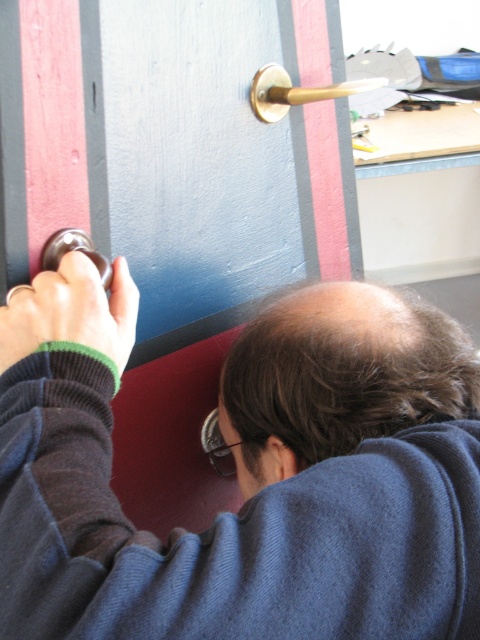
You are a technician trying to fix a door handle. You have a tool that is 24 inches long. You need to reach from the point at the door handle to the point at the screw located at point (231, 419). Can your tool reach both points without moving?

The distance between the door handle and the point at (231, 419) is 24.58 inches. Since your tool is only 24 inches long, it cannot reach both points without moving.

You are looking at the image of a person working on a door handle. Where exactly is the dark blue sweater at center located in terms of coordinates?

The dark blue sweater at center is located at coordinates point (245, 474).

You are a repair technician assessing the workspace. You notice the green knitted wristband at lower left and the polished brass door handle at upper left. Which object would you estimate has a greater surface area?

→ The green knitted wristband at lower left has a larger size than the polished brass door handle at upper left, so it has a greater surface area.